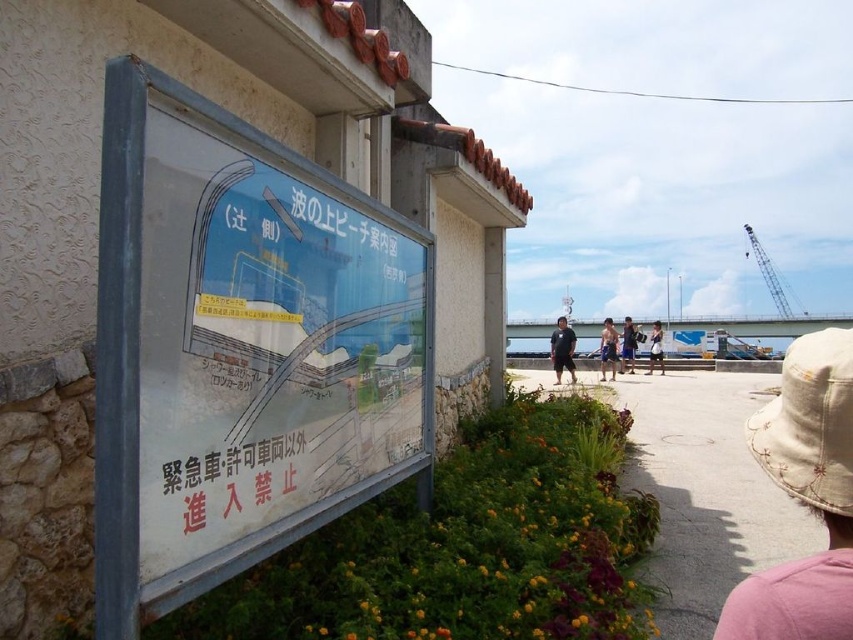
Looking at this image, is beige fabric hat at lower right positioned behind matte black shirt at center?

No, it is in front of matte black shirt at center.

At what (x,y) coordinates should I click in order to perform the action: click on beige fabric hat at lower right. Please return your answer as a coordinate pair (x, y). Looking at the image, I should click on (804, 497).

Locate an element on the screen. The height and width of the screenshot is (640, 853). beige fabric hat at lower right is located at coordinates (804, 497).

Can you confirm if white plastic sign at center is thinner than blue denim shorts at center?

Indeed, white plastic sign at center has a lesser width compared to blue denim shorts at center.

Who is shorter, white plastic sign at center or blue denim shorts at center?

white plastic sign at center

Is point (428, 298) closer to camera compared to point (614, 346)?

Yes, point (428, 298) is closer to viewer.

You are a GUI agent. You are given a task and a screenshot of the screen. Output one action in this format:
    pyautogui.click(x=<x>, y=<y>)
    Task: Click on the white plastic sign at center
    The width and height of the screenshot is (853, 640).
    Given the screenshot: What is the action you would take?
    pyautogui.click(x=241, y=348)

Can you confirm if blue denim shorts at center is wider than tan fabric shorts at center?

Yes, blue denim shorts at center is wider than tan fabric shorts at center.

Is point (613, 346) in front of point (630, 371)?

Yes, point (613, 346) is closer to viewer.

Is point (605, 352) positioned behind point (630, 348)?

No, (605, 352) is closer to viewer.

The image size is (853, 640). I want to click on blue denim shorts at center, so click(x=608, y=348).